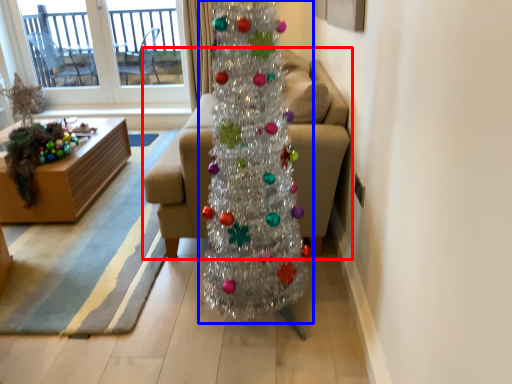
Question: Which object appears closest to the camera in this image, studio couch (highlighted by a red box) or christmas tree (highlighted by a blue box)?

Choices:
 (A) studio couch
 (B) christmas tree

Answer: (B)